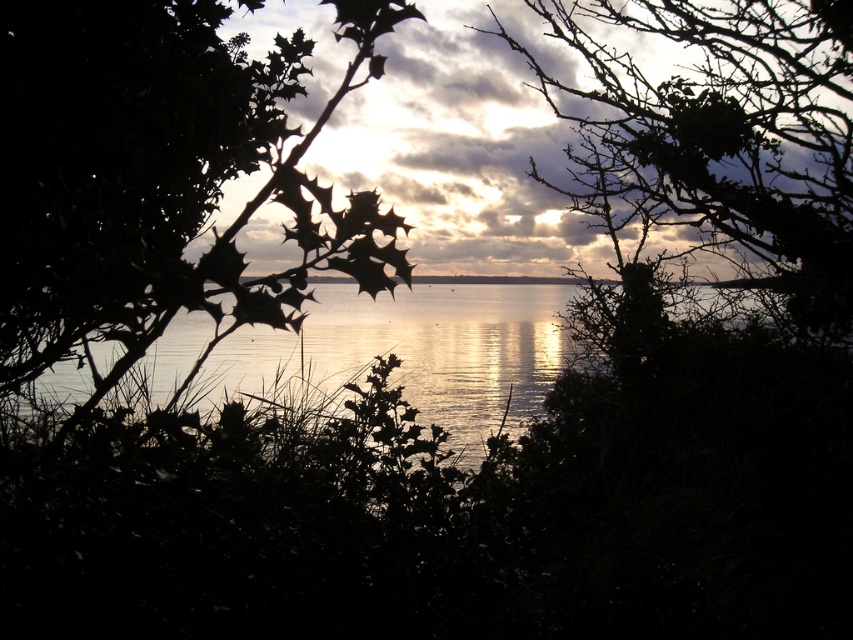
You are standing in a garden and looking through the dark silhouetted foliage at the sunset scene. There is a point at coordinates point (463, 144). What does this point represent in the scene?

The point at coordinates point (463, 144) represents the cloudy sky at center.

You are an artist trying to paint the sunset scene. You notice two elements at the center of your view, the cloudy sky at center and the silvery reflective water at center. Which one should you paint first if you want to focus on the larger element first?

The cloudy sky at center has a larger size compared to the silvery reflective water at center, so you should paint the cloudy sky at center first.